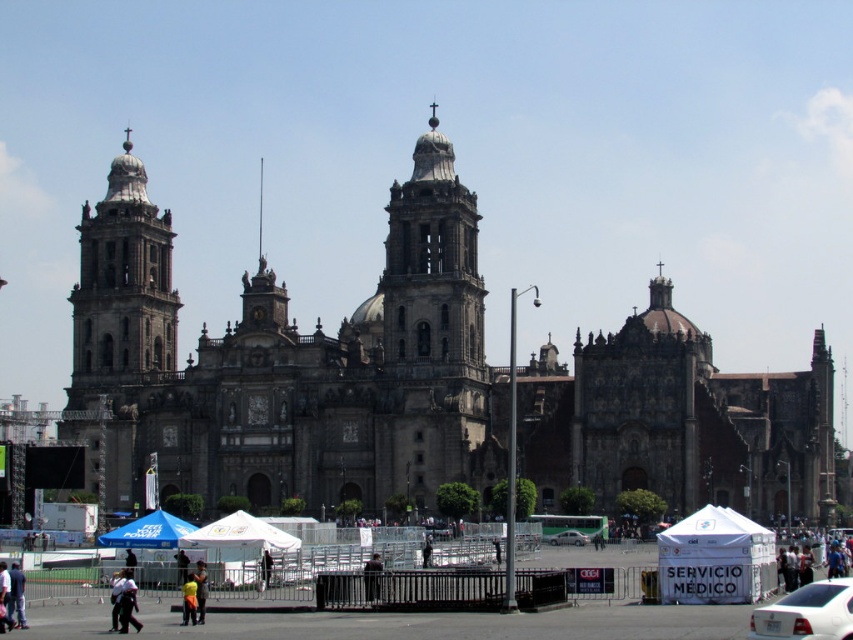
Question: Where is yellow fabric person at lower center located in relation to silver metallic sedan at center in the image?

Choices:
 (A) left
 (B) right

Answer: (A)

Question: Does dark gray stone church at center appear over silver metallic sedan at center?

Choices:
 (A) no
 (B) yes

Answer: (B)

Question: Is black leather jacket at lower center further to the viewer compared to silver metallic sedan at center?

Choices:
 (A) yes
 (B) no

Answer: (B)

Question: Estimate the real-world distances between objects in this image. Which object is farther from the silver metallic sedan at center?

Choices:
 (A) black fabric umbrella at center
 (B) white cotton shirt at lower left

Answer: (B)

Question: Based on their relative distances, which object is nearer to the white cotton shirt at lower left?

Choices:
 (A) silver metallic sedan at center
 (B) white glossy sedan at lower right

Answer: (B)

Question: Which point appears farthest from the camera in this image?

Choices:
 (A) (271, 561)
 (B) (585, 538)
 (C) (126, 584)

Answer: (B)